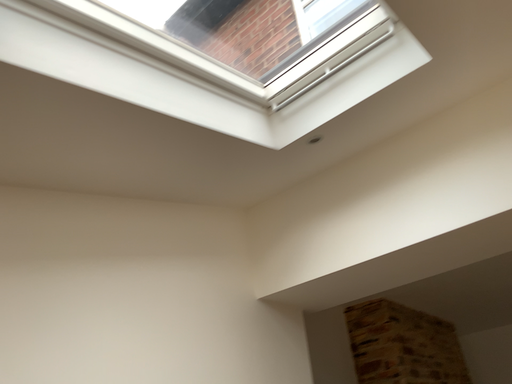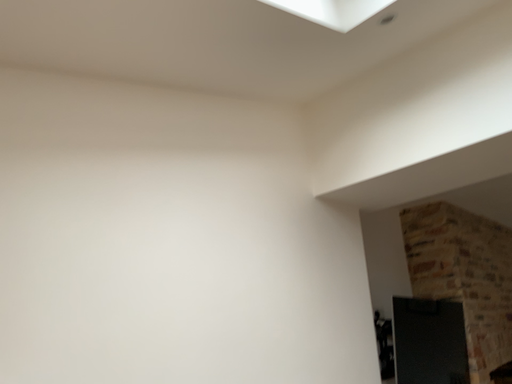
Question: How did the camera likely rotate when shooting the video?

Choices:
 (A) rotated upward
 (B) rotated downward

Answer: (B)